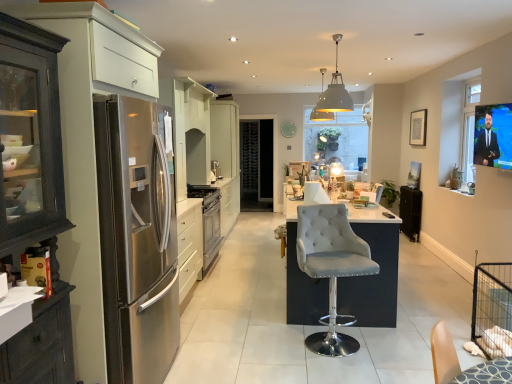
The width and height of the screenshot is (512, 384). Identify the location of stainless steel oven at center. (209, 221).

The image size is (512, 384). What do you see at coordinates (335, 91) in the screenshot?
I see `matte gray pendant light at center` at bounding box center [335, 91].

Describe the element at coordinates (116, 196) in the screenshot. I see `satin silver refrigerator at left` at that location.

At what (x,y) coordinates should I click in order to perform the action: click on black glass wine cellar at center. Please return your answer as a coordinate pair (x, y). Looking at the image, I should click on (257, 162).

Considering the positions of objects black glass wine cellar at center and satin silver refrigerator at left in the image provided, who is more to the right, black glass wine cellar at center or satin silver refrigerator at left?

black glass wine cellar at center is more to the right.

Considering the positions of point (244, 196) and point (20, 158), is point (244, 196) closer or farther from the camera than point (20, 158)?

Point (244, 196).

Which of these two, matte gray pendant light at center or black glass wine cellar at center, is wider?

matte gray pendant light at center.

Is black glass wine cellar at center located within matte gray pendant light at center?

Definitely not — black glass wine cellar at center is not inside matte gray pendant light at center.

Is point (326, 95) closer or farther from the camera than point (253, 147)?

Point (326, 95) is positioned closer to the camera compared to point (253, 147).

Which object is closer to the camera, matte gray pendant light at center or black glass wine cellar at center?

matte gray pendant light at center is in front.

Is black glass wine cellar at center further to the viewer compared to stainless steel oven at center?

Yes, black glass wine cellar at center is further from the camera.

Based on the photo, are black glass wine cellar at center and stainless steel oven at center located far from each other?

Yes, black glass wine cellar at center is far from stainless steel oven at center.

Which of these two, black glass wine cellar at center or stainless steel oven at center, is thinner?

black glass wine cellar at center.

Where is `chair that appears below the black glass wine cellar at center (from a real-world perspective)`? chair that appears below the black glass wine cellar at center (from a real-world perspective) is located at coordinates (331, 268).

Based on their positions, is suede-like gray bar stool at center located to the left or right of black glass wine cellar at center?

suede-like gray bar stool at center is positioned on black glass wine cellar at center's right side.

Between suede-like gray bar stool at center and black glass wine cellar at center, which one has larger size?

black glass wine cellar at center.

Is suede-like gray bar stool at center not close to black glass wine cellar at center?

Yes, suede-like gray bar stool at center and black glass wine cellar at center are located far from each other.

Measure the distance from black glass wine cellar at center to suede-like gray bar stool at center.

black glass wine cellar at center and suede-like gray bar stool at center are 5.54 meters apart.

Considering the sizes of objects black glass wine cellar at center and suede-like gray bar stool at center in the image provided, who is bigger, black glass wine cellar at center or suede-like gray bar stool at center?

Bigger between the two is black glass wine cellar at center.

Considering the positions of point (245, 191) and point (321, 232), is point (245, 191) closer or farther from the camera than point (321, 232)?

Clearly, point (245, 191) is more distant from the camera than point (321, 232).

I want to click on chair below the black glass wine cellar at center (from the image's perspective), so click(331, 268).

Which is more to the right, stainless steel oven at center or suede-like gray bar stool at center?

From the viewer's perspective, suede-like gray bar stool at center appears more on the right side.

From the image's perspective, between stainless steel oven at center and suede-like gray bar stool at center, which one is located above?

stainless steel oven at center.

Is the position of stainless steel oven at center less distant than that of suede-like gray bar stool at center?

That is False.

Choose the correct answer: Is stainless steel oven at center inside suede-like gray bar stool at center or outside it?

stainless steel oven at center exists outside the volume of suede-like gray bar stool at center.

Looking at this image, is black glass wine cellar at center far away from satin silver oven at center, marked as the second appliance in a bottom-to-top arrangement?

Absolutely, black glass wine cellar at center is distant from satin silver oven at center, marked as the second appliance in a bottom-to-top arrangement.

Considering the relative sizes of black glass wine cellar at center and satin silver oven at center, which is counted as the second appliance, starting from the right, in the image provided, is black glass wine cellar at center smaller than satin silver oven at center, which is counted as the second appliance, starting from the right,?

No, black glass wine cellar at center is not smaller than satin silver oven at center, which is counted as the second appliance, starting from the right.

Which is correct: black glass wine cellar at center is inside satin silver oven at center, which is counted as the second appliance, starting from the right, or outside of it?

black glass wine cellar at center exists outside the volume of satin silver oven at center, which is counted as the second appliance, starting from the right.

Where is `entertainment center that is on the left side of black glass wine cellar at center`? Image resolution: width=512 pixels, height=384 pixels. entertainment center that is on the left side of black glass wine cellar at center is located at coordinates (116, 196).

Find the location of a particular element. This screenshot has height=384, width=512. glass door below the matte gray pendant light at center (from a real-world perspective) is located at coordinates (257, 162).

Considering their positions, is satin silver refrigerator at left positioned further to satin silver oven at center, which is counted as the second appliance, starting from the right, than black glass wine cellar at center?

Among the two, satin silver refrigerator at left is located further to satin silver oven at center, which is counted as the second appliance, starting from the right.

When comparing their distances from black glass wine cellar at center, does white glossy cabinet at center or satin silver oven at center, which is counted as the second appliance, starting from the right, seem further?

Based on the image, satin silver oven at center, which is counted as the second appliance, starting from the right, appears to be further to black glass wine cellar at center.

When comparing their distances from black glass wine cellar at center, does matte gray pendant light at center or satin silver oven at center, positioned as the 1th appliance in left-to-right order, seem further?

matte gray pendant light at center is positioned further to the anchor black glass wine cellar at center.

Which object lies nearer to the anchor point black glass wine cellar at center, matte gray pendant light at center or black matte radiator at right, which appears as the 2th appliance when viewed from the top?

black matte radiator at right, which appears as the 2th appliance when viewed from the top.

Estimate the real-world distances between objects in this image. Which object is further from satin silver refrigerator at left, white glossy cabinet at center or matte gray pendant light at center?

Among the two, white glossy cabinet at center is located further to satin silver refrigerator at left.

When comparing their distances from black glass wine cellar at center, does black matte radiator at right, which appears as the 2th appliance when viewed from the top, or suede-like gray bar stool at center seem further?

Among the two, suede-like gray bar stool at center is located further to black glass wine cellar at center.

Considering their positions, is stainless steel oven at center positioned closer to black matte radiator at right, marked as the second appliance in a left-to-right arrangement, than black glass wine cellar at center?

black glass wine cellar at center is positioned closer to the anchor black matte radiator at right, marked as the second appliance in a left-to-right arrangement.

Looking at the image, which one is located closer to stainless steel oven at center, white glossy cabinet at center or black glass wine cellar at center?

white glossy cabinet at center is closer to stainless steel oven at center.

Where is `light fixture located between stainless steel oven at center and black matte radiator at right, acting as the first appliance starting from the bottom, in the left-right direction`? light fixture located between stainless steel oven at center and black matte radiator at right, acting as the first appliance starting from the bottom, in the left-right direction is located at coordinates (335, 91).

You are a GUI agent. You are given a task and a screenshot of the screen. Output one action in this format:
    pyautogui.click(x=<x>, y=<y>)
    Task: Click on the kitchen appliance located between satin silver refrigerator at left and white glossy cabinet at center in the depth direction
    The height and width of the screenshot is (384, 512).
    Given the screenshot: What is the action you would take?
    [x=209, y=221]

In order to click on light fixture located between suede-like gray bar stool at center and black matte radiator at right, acting as the first appliance starting from the bottom, in the depth direction in this screenshot , I will do `click(335, 91)`.

Find the location of a particular element. kitchen appliance between matte gray pendant light at center and suede-like gray bar stool at center from top to bottom is located at coordinates (209, 221).